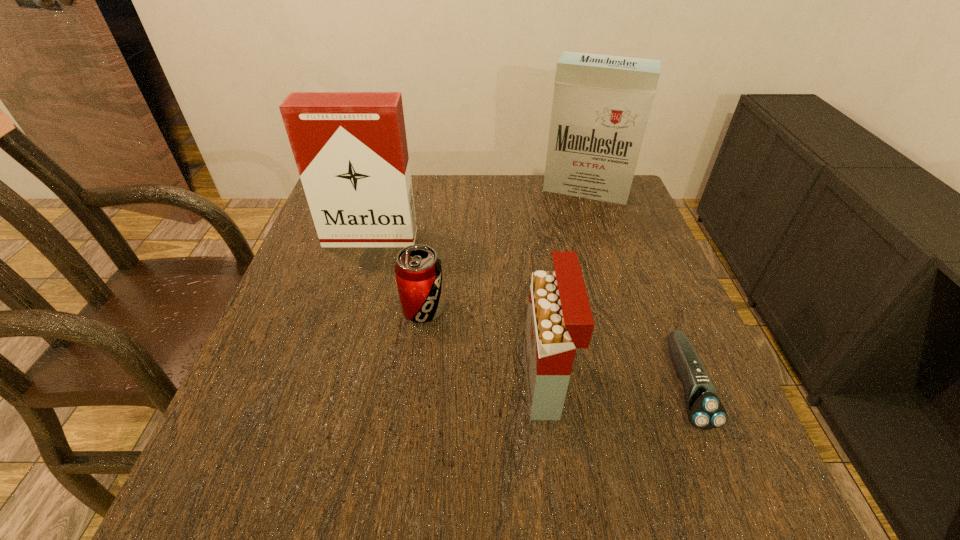
Locate an element on the screen. the farthest cigarette case is located at coordinates (601, 104).

I want to click on the rightmost cigarette case, so click(x=601, y=104).

Where is `the second farthest cigarette case`? The height and width of the screenshot is (540, 960). the second farthest cigarette case is located at coordinates (350, 148).

Where is `the leftmost cigarette case`? The image size is (960, 540). the leftmost cigarette case is located at coordinates (350, 148).

The image size is (960, 540). What are the coordinates of `the third shortest object` in the screenshot? It's located at (559, 320).

This screenshot has width=960, height=540. In order to click on the third object from left to right in this screenshot , I will do `click(559, 320)`.

I want to click on the second shortest object, so click(x=418, y=270).

This screenshot has width=960, height=540. What are the coordinates of `soda can` in the screenshot? It's located at pyautogui.click(x=418, y=270).

Locate an element on the screen. This screenshot has height=540, width=960. electric shaver is located at coordinates (705, 411).

Where is `free space located 0.400m on the left of the farthest cigarette case`? This screenshot has width=960, height=540. free space located 0.400m on the left of the farthest cigarette case is located at coordinates (406, 190).